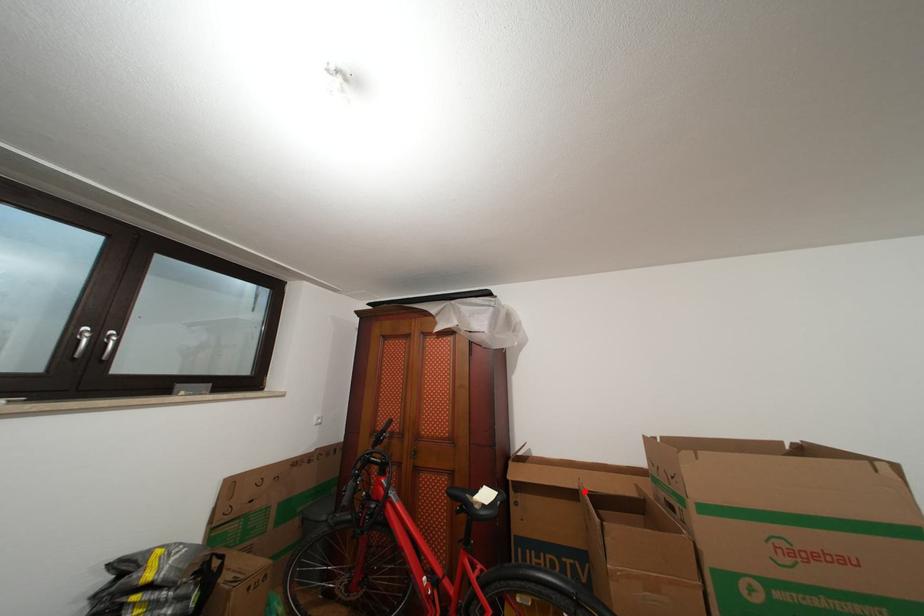
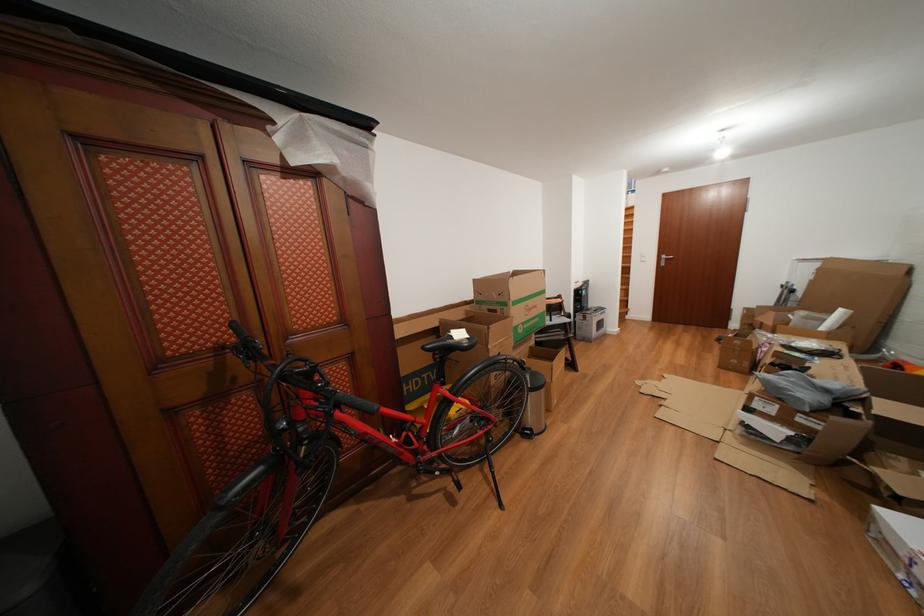
The point at the highlighted location is marked in the first image. Where is the corresponding point in the second image?

(445, 330)